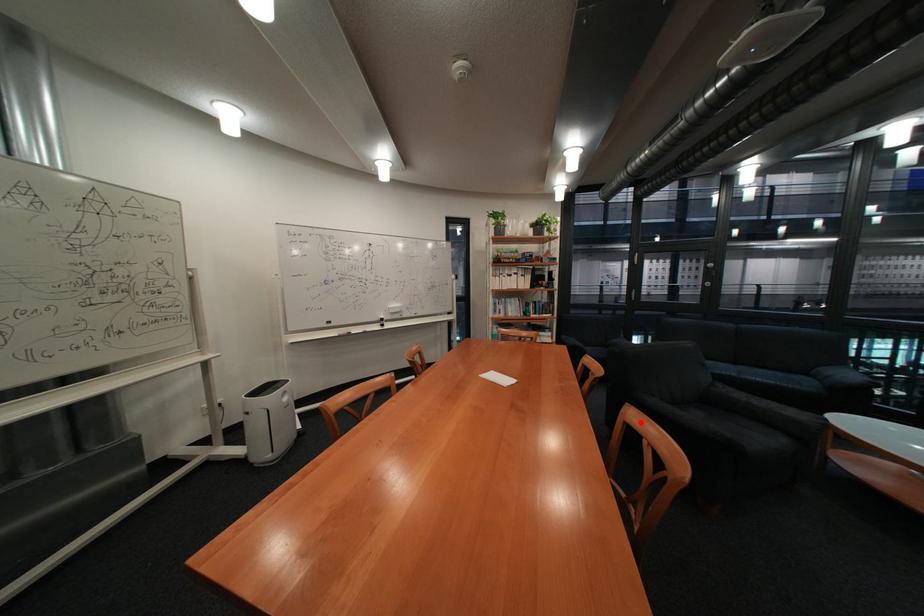
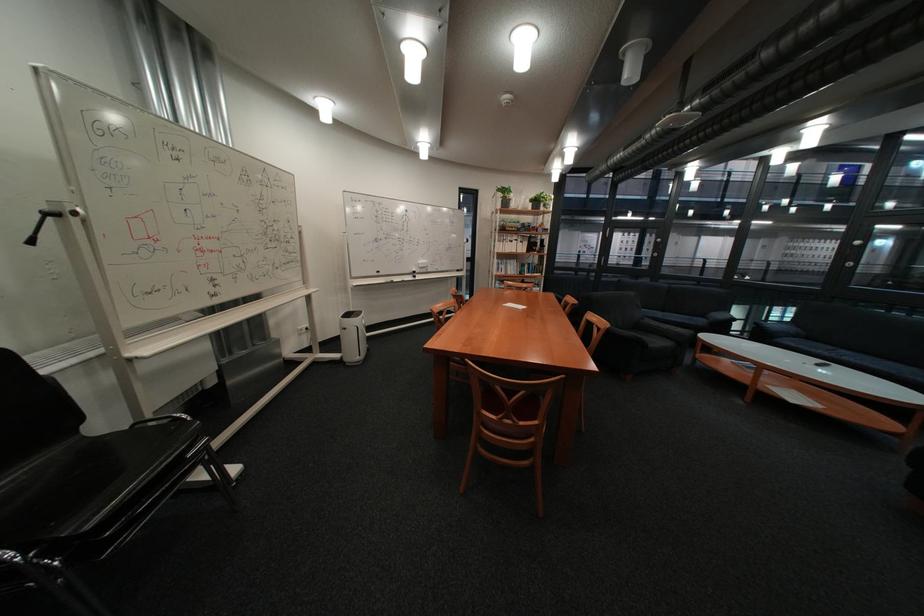
Question: I am providing you with two images of the same scene from different viewpoints. In image1, a red point is highlighted. Considering the same 3D point in image2, which of the following is correct?

Choices:
 (A) It is closer
 (B) It is farther

Answer: (A)